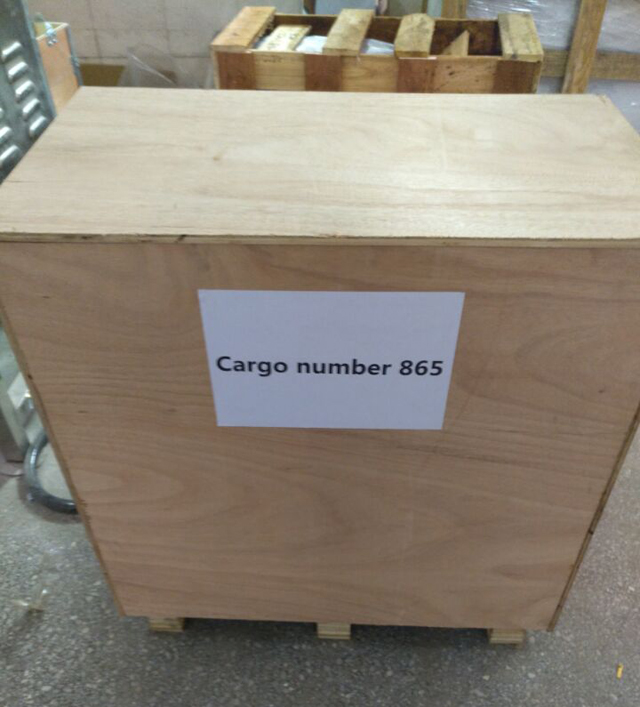
At what (x,y) coordinates should I click in order to perform the action: click on piece of white paper. Please return your answer as a coordinate pair (x, y). Image resolution: width=640 pixels, height=707 pixels. Looking at the image, I should click on (324, 343).